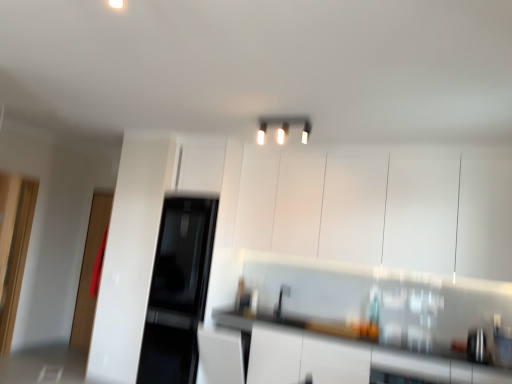
What is the approximate width of transparent glass door at left, the 1th glass door from the back?

The width of transparent glass door at left, the 1th glass door from the back, is 3.19 inches.

Describe the element at coordinates (477, 346) in the screenshot. This screenshot has width=512, height=384. I see `sleek stainless steel kettle at lower right, which is the 1th appliance from front to back` at that location.

Locate an element on the screen. This screenshot has width=512, height=384. black glass refrigerator at center, which is the first appliance in back-to-front order is located at coordinates (178, 291).

Describe the element at coordinates (283, 127) in the screenshot. I see `white glossy light fixture at upper center` at that location.

What is the approximate height of white glossy countertop at lower right?

white glossy countertop at lower right is 31.83 inches in height.

The width and height of the screenshot is (512, 384). Identify the location of transparent glass door at left, placed as the 2th glass door when sorted from front to back. [x=90, y=272].

Which is more to the left, black glass refrigerator at center, the 1th appliance positioned from the left, or transparent glass door at left, which is counted as the 1th glass door, starting from the front?

transparent glass door at left, which is counted as the 1th glass door, starting from the front, is more to the left.

Based on the photo, which point is more forward, (162, 246) or (13, 318)?

The point (13, 318) is in front.

From the image's perspective, relative to transparent glass door at left, the second glass door viewed from the back, is black glass refrigerator at center, acting as the 1th appliance starting from the top, above or below?

black glass refrigerator at center, acting as the 1th appliance starting from the top, is situated lower than transparent glass door at left, the second glass door viewed from the back, in the image.

Measure the distance from white glossy countertop at lower right to transparent glass door at left, the 1th glass door from the back.

The distance of white glossy countertop at lower right from transparent glass door at left, the 1th glass door from the back, is 3.19 meters.

Where is `counter top directly beneath the transparent glass door at left, placed as the 2th glass door when sorted from front to back (from a real-world perspective)`? Image resolution: width=512 pixels, height=384 pixels. counter top directly beneath the transparent glass door at left, placed as the 2th glass door when sorted from front to back (from a real-world perspective) is located at coordinates (340, 355).

In the scene shown: Is white glossy countertop at lower right thinner than transparent glass door at left, placed as the 2th glass door when sorted from front to back?

Incorrect, the width of white glossy countertop at lower right is not less than that of transparent glass door at left, placed as the 2th glass door when sorted from front to back.

From a real-world perspective, does white glossy countertop at lower right stand above transparent glass door at left, the 1th glass door from the back?

No, from a real-world perspective, white glossy countertop at lower right is not over transparent glass door at left, the 1th glass door from the back

Who is bigger, sleek stainless steel kettle at lower right, the second appliance in the left-to-right sequence, or transparent glass door at left, which is counted as the 1th glass door, starting from the front?

With larger size is transparent glass door at left, which is counted as the 1th glass door, starting from the front.

Is sleek stainless steel kettle at lower right, placed as the 1th appliance when sorted from bottom to top, facing away from transparent glass door at left, the second glass door viewed from the back?

That's not correct — sleek stainless steel kettle at lower right, placed as the 1th appliance when sorted from bottom to top, is not looking away from transparent glass door at left, the second glass door viewed from the back.

From the picture: Which of these two, sleek stainless steel kettle at lower right, which is the 1th appliance from front to back, or white glossy light fixture at upper center, stands shorter?

white glossy light fixture at upper center.

Is sleek stainless steel kettle at lower right, arranged as the 1th appliance when viewed from the right, bigger than white glossy light fixture at upper center?

No, sleek stainless steel kettle at lower right, arranged as the 1th appliance when viewed from the right, is not bigger than white glossy light fixture at upper center.

Considering the relative positions of sleek stainless steel kettle at lower right, marked as the second appliance in a back-to-front arrangement, and white glossy light fixture at upper center in the image provided, is sleek stainless steel kettle at lower right, marked as the second appliance in a back-to-front arrangement, to the right of white glossy light fixture at upper center from the viewer's perspective?

Correct, you'll find sleek stainless steel kettle at lower right, marked as the second appliance in a back-to-front arrangement, to the right of white glossy light fixture at upper center.

Which of these two, white glossy light fixture at upper center or sleek stainless steel kettle at lower right, marked as the second appliance in a back-to-front arrangement, is thinner?

Thinner between the two is white glossy light fixture at upper center.

From the image's perspective, which one is positioned higher, white glossy light fixture at upper center or sleek stainless steel kettle at lower right, arranged as the 1th appliance when viewed from the right?

white glossy light fixture at upper center.

Is white glossy light fixture at upper center in contact with sleek stainless steel kettle at lower right, the 2th appliance when ordered from top to bottom?

No, white glossy light fixture at upper center is not next to sleek stainless steel kettle at lower right, the 2th appliance when ordered from top to bottom.

From a real-world perspective, is black glass refrigerator at center, which is the first appliance in back-to-front order, positioned above or below white glossy countertop at lower right?

Clearly, from a real-world perspective, black glass refrigerator at center, which is the first appliance in back-to-front order, is above white glossy countertop at lower right.

Is black glass refrigerator at center, arranged as the 2th appliance when viewed from the right, in front of or behind white glossy countertop at lower right in the image?

Clearly, black glass refrigerator at center, arranged as the 2th appliance when viewed from the right, is behind white glossy countertop at lower right.

Looking at the image, does black glass refrigerator at center, the 2th appliance in the bottom-to-top sequence, seem bigger or smaller compared to white glossy countertop at lower right?

Clearly, black glass refrigerator at center, the 2th appliance in the bottom-to-top sequence, is smaller in size than white glossy countertop at lower right.

Are black glass refrigerator at center, the 2th appliance in the bottom-to-top sequence, and white glossy countertop at lower right far apart?

black glass refrigerator at center, the 2th appliance in the bottom-to-top sequence, is positioned a significant distance from white glossy countertop at lower right.

Between black glass refrigerator at center, which is the first appliance in back-to-front order, and white glossy light fixture at upper center, which one has more height?

Standing taller between the two is black glass refrigerator at center, which is the first appliance in back-to-front order.

Based on the photo, between black glass refrigerator at center, the 1th appliance positioned from the left, and white glossy light fixture at upper center, which one has smaller size?

With smaller size is white glossy light fixture at upper center.

Is black glass refrigerator at center, the 2th appliance positioned from the front, thinner than white glossy light fixture at upper center?

In fact, black glass refrigerator at center, the 2th appliance positioned from the front, might be wider than white glossy light fixture at upper center.

Is the position of black glass refrigerator at center, arranged as the 2th appliance when viewed from the right, less distant than that of white glossy light fixture at upper center?

No.

This screenshot has height=384, width=512. Identify the location of glass door in front of the black glass refrigerator at center, acting as the 1th appliance starting from the top. (13, 247).

The height and width of the screenshot is (384, 512). I want to click on glass door that is the 2nd one when counting backward from the white glossy countertop at lower right, so click(x=90, y=272).

Considering their positions, is white glossy countertop at lower right positioned further to white glossy light fixture at upper center than transparent glass door at left, which is counted as the 1th glass door, starting from the front?

transparent glass door at left, which is counted as the 1th glass door, starting from the front, lies further to white glossy light fixture at upper center than the other object.

From the image, which object appears to be farther from sleek stainless steel kettle at lower right, placed as the 1th appliance when sorted from bottom to top, black glass refrigerator at center, which is the first appliance in back-to-front order, or white glossy light fixture at upper center?

black glass refrigerator at center, which is the first appliance in back-to-front order, is positioned further to the anchor sleek stainless steel kettle at lower right, placed as the 1th appliance when sorted from bottom to top.

Based on their spatial positions, is black glass refrigerator at center, arranged as the 2th appliance when viewed from the right, or white glossy light fixture at upper center further from white glossy countertop at lower right?

white glossy light fixture at upper center is positioned further to the anchor white glossy countertop at lower right.

From the image, which object appears to be nearer to transparent glass door at left, which is counted as the 1th glass door, starting from the front, white glossy countertop at lower right or transparent glass door at left, the 1th glass door from the back?

Based on the image, transparent glass door at left, the 1th glass door from the back, appears to be nearer to transparent glass door at left, which is counted as the 1th glass door, starting from the front.

Which object lies further to the anchor point black glass refrigerator at center, arranged as the 2th appliance when viewed from the right, transparent glass door at left, placed as the 2th glass door when sorted from front to back, or white glossy countertop at lower right?

white glossy countertop at lower right is further to black glass refrigerator at center, arranged as the 2th appliance when viewed from the right.

From the image, which object appears to be farther from sleek stainless steel kettle at lower right, placed as the 1th appliance when sorted from bottom to top, white glossy countertop at lower right or transparent glass door at left, which is counted as the 1th glass door, starting from the front?

Based on the image, transparent glass door at left, which is counted as the 1th glass door, starting from the front, appears to be further to sleek stainless steel kettle at lower right, placed as the 1th appliance when sorted from bottom to top.

Looking at the image, which one is located closer to sleek stainless steel kettle at lower right, placed as the 1th appliance when sorted from bottom to top, transparent glass door at left, the second glass door viewed from the back, or white glossy countertop at lower right?

The object closer to sleek stainless steel kettle at lower right, placed as the 1th appliance when sorted from bottom to top, is white glossy countertop at lower right.

Based on their spatial positions, is transparent glass door at left, the second glass door viewed from the back, or transparent glass door at left, placed as the 2th glass door when sorted from front to back, closer to white glossy light fixture at upper center?

transparent glass door at left, the second glass door viewed from the back, is positioned closer to the anchor white glossy light fixture at upper center.

Locate an element on the screen. This screenshot has width=512, height=384. counter top between transparent glass door at left, which is counted as the 1th glass door, starting from the front, and sleek stainless steel kettle at lower right, placed as the 1th appliance when sorted from bottom to top, in the horizontal direction is located at coordinates [x=340, y=355].

Identify the location of counter top between black glass refrigerator at center, acting as the 1th appliance starting from the top, and sleek stainless steel kettle at lower right, the second appliance in the left-to-right sequence. This screenshot has width=512, height=384. (340, 355).

Identify the location of appliance between transparent glass door at left, the second glass door viewed from the back, and sleek stainless steel kettle at lower right, placed as the 1th appliance when sorted from bottom to top. (178, 291).

Where is `light fixture located between transparent glass door at left, the 1th glass door from the back, and white glossy countertop at lower right in the left-right direction`? The width and height of the screenshot is (512, 384). light fixture located between transparent glass door at left, the 1th glass door from the back, and white glossy countertop at lower right in the left-right direction is located at coordinates (283, 127).